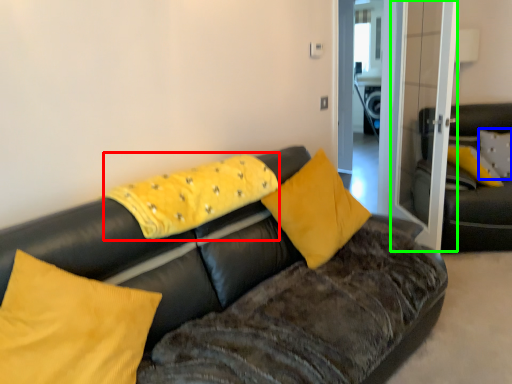
Question: Considering the real-world distances, which object is closest to pillow (highlighted by a red box)? pillow (highlighted by a blue box) or glass door (highlighted by a green box).

Choices:
 (A) pillow
 (B) glass door

Answer: (B)